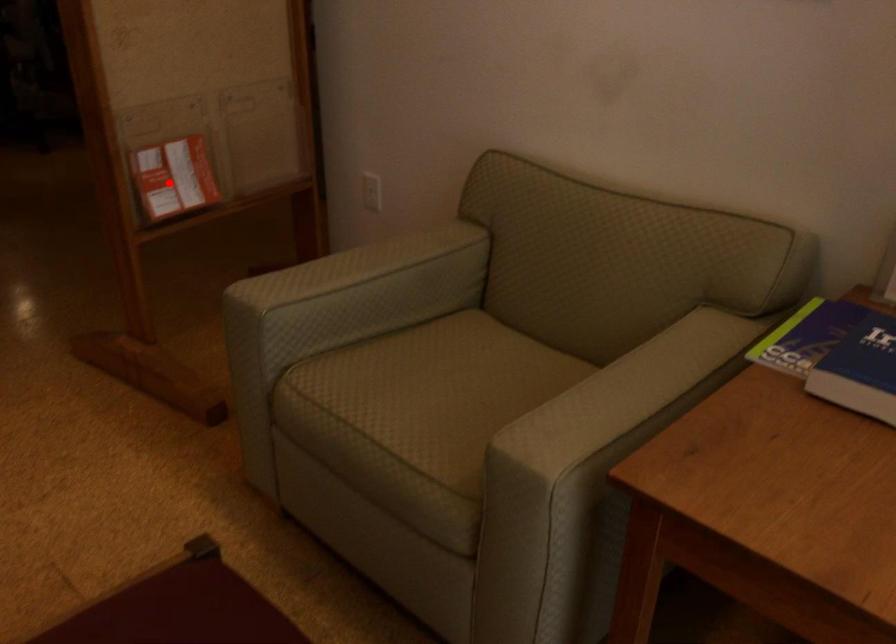
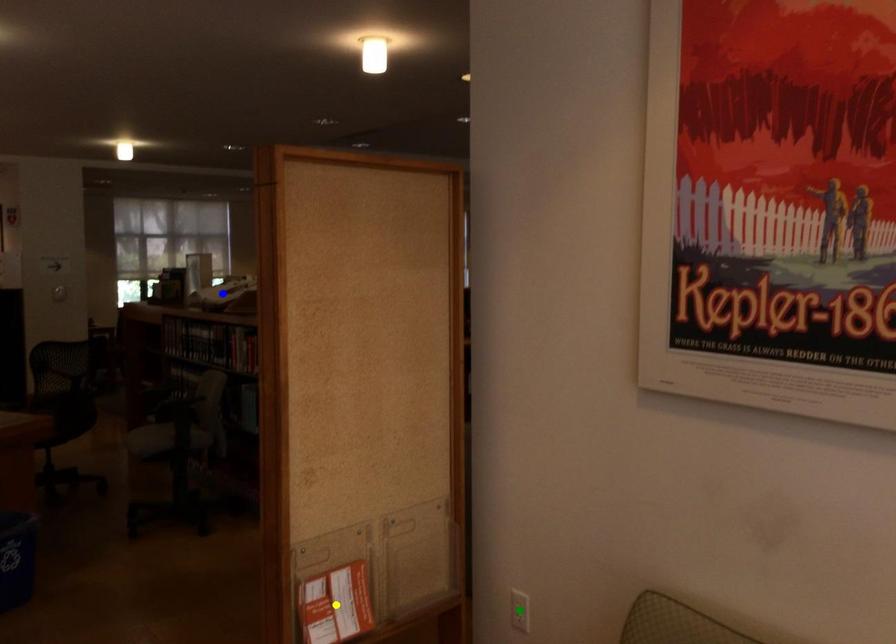
Question: I am providing you with two images of the same scene from different viewpoints. A red point is marked on the first image. You are given multiple points on the second image. Which point in image 2 is actually the same real-world point as the red point in image 1?

Choices:
 (A) blue point
 (B) green point
 (C) yellow point

Answer: (C)